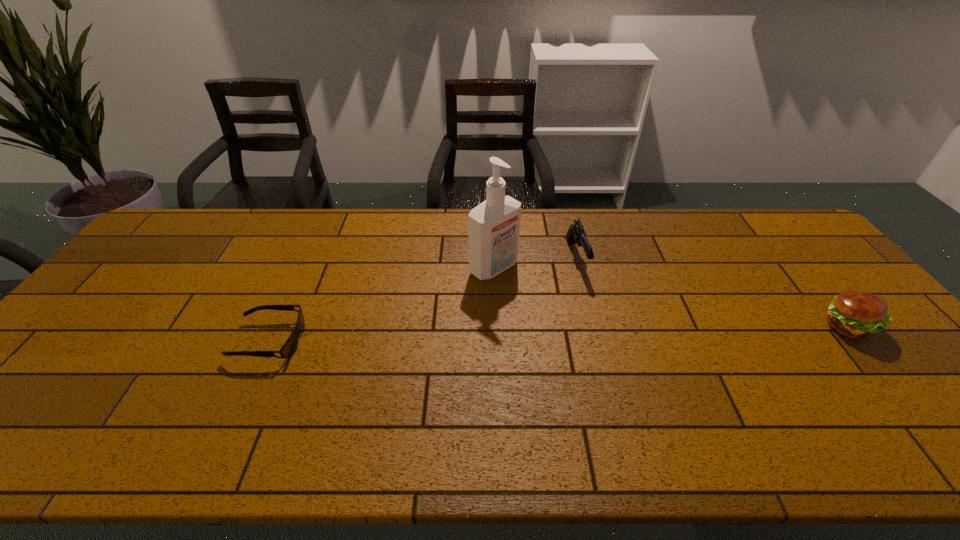
Image resolution: width=960 pixels, height=540 pixels. What are the coordinates of `the leftmost object` in the screenshot? It's located at [x=289, y=348].

Locate an element on the screen. Image resolution: width=960 pixels, height=540 pixels. sunglasses is located at coordinates (289, 348).

At what (x,y) coordinates should I click in order to perform the action: click on the rightmost object. Please return your answer as a coordinate pair (x, y). The width and height of the screenshot is (960, 540). Looking at the image, I should click on (856, 314).

This screenshot has width=960, height=540. I want to click on cleansing agent, so click(x=493, y=226).

The image size is (960, 540). In order to click on gun in this screenshot , I will do `click(576, 234)`.

The image size is (960, 540). Identify the location of the farthest object. (485, 197).

Where is `free space located on the front-facing side of the shortest object`? The height and width of the screenshot is (540, 960). free space located on the front-facing side of the shortest object is located at coordinates (85, 340).

Where is `vacant space located 0.240m on the front-facing side of the shortest object`? The width and height of the screenshot is (960, 540). vacant space located 0.240m on the front-facing side of the shortest object is located at coordinates (144, 340).

I want to click on free space located 0.110m on the front-facing side of the shortest object, so click(x=194, y=340).

What are the coordinates of `vacant region located 0.260m on the left of the hamburger` in the screenshot? It's located at (724, 327).